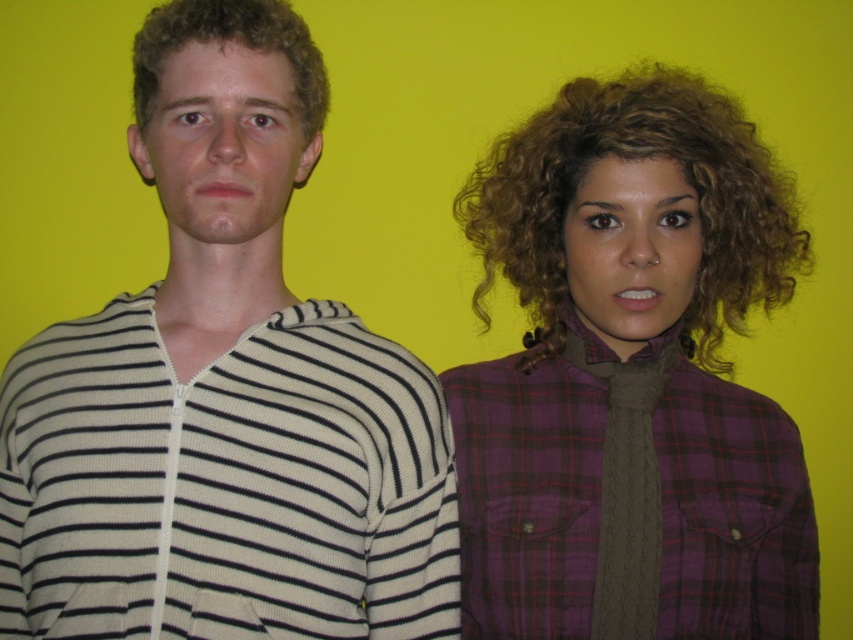
You are a photographer setting up a photo shoot. You need to ensure that the white striped sweater at left and the curly blonde hair at left are both visible in the final image. Based on their positions, which object should you focus on to ensure both are in focus?

The white striped sweater at left is in front of curly blonde hair at left. To ensure both are in focus, you should focus on the white striped sweater at left since it is closer to the camera, and the curly blonde hair at left will naturally be in focus as it is behind the sweater.

You are organizing a clothing store and need to arrange these two items next to each other. Since the white striped sweater at left is on the left side of the purple plaid shirt at right, which item should be placed to the left when arranging them in the store?

The white striped sweater at left should be placed to the left of the purple plaid shirt at right because it is positioned on the left side of the purple plaid shirt at right in the image.